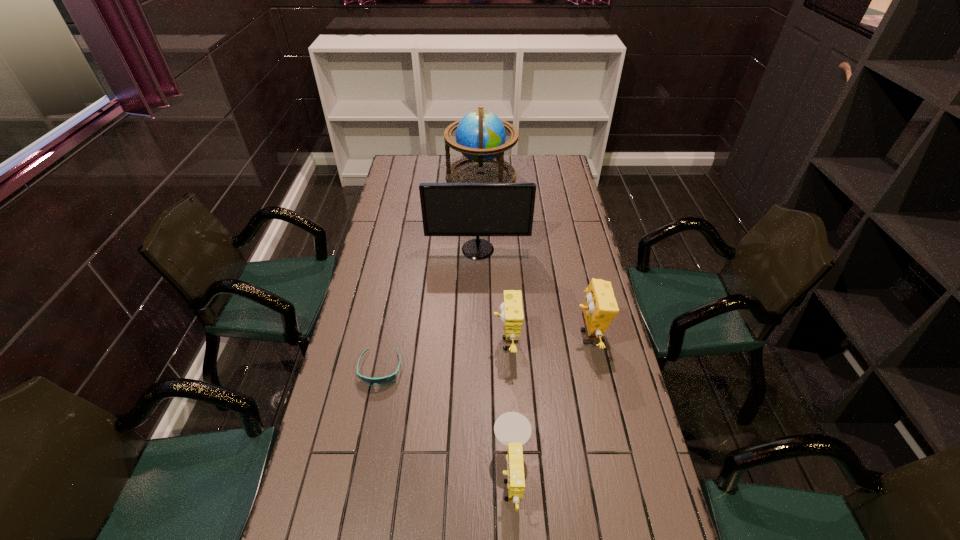
What are the coordinates of `globe` in the screenshot? It's located at (480, 135).

I want to click on the fifth nearest object, so click(448, 209).

Identify the location of computer monitor. The width and height of the screenshot is (960, 540). (448, 209).

You are a GUI agent. You are given a task and a screenshot of the screen. Output one action in this format:
    pyautogui.click(x=<x>, y=<y>)
    Task: Click on the rightmost sponge
    
    Given the screenshot: What is the action you would take?
    pyautogui.click(x=600, y=307)

The width and height of the screenshot is (960, 540). In order to click on the nearest sponge in this screenshot , I will do `click(512, 429)`.

You are a GUI agent. You are given a task and a screenshot of the screen. Output one action in this format:
    pyautogui.click(x=<x>, y=<y>)
    Task: Click on the second shortest object
    The width and height of the screenshot is (960, 540).
    Given the screenshot: What is the action you would take?
    pyautogui.click(x=512, y=429)

Image resolution: width=960 pixels, height=540 pixels. I want to click on the shortest object, so click(x=382, y=381).

The width and height of the screenshot is (960, 540). Identify the location of sunglasses. (382, 381).

The height and width of the screenshot is (540, 960). What are the coordinates of `free location located 0.250m on the right of the globe` in the screenshot? It's located at (566, 177).

The height and width of the screenshot is (540, 960). What are the coordinates of `vacant space located on the front-facing side of the computer monitor` in the screenshot? It's located at (x=477, y=309).